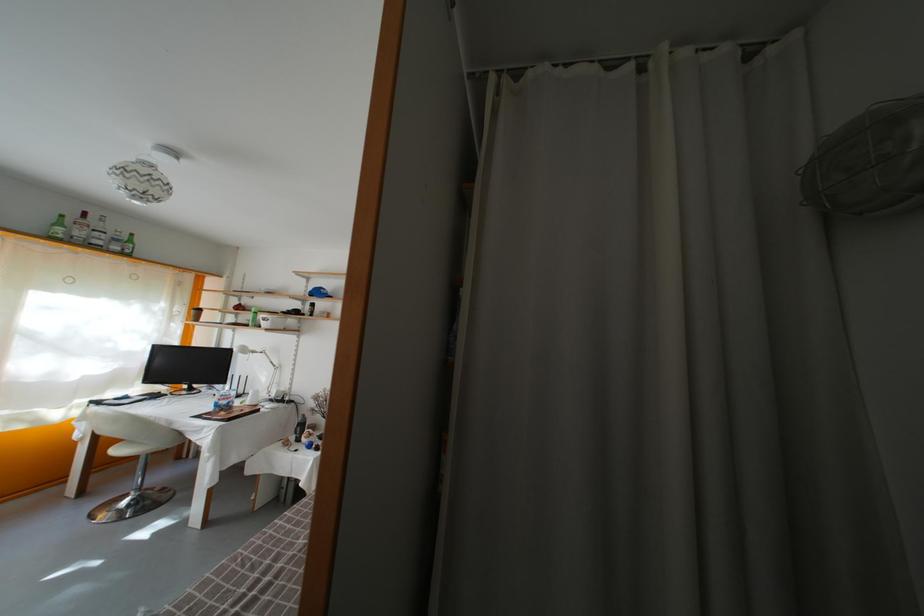
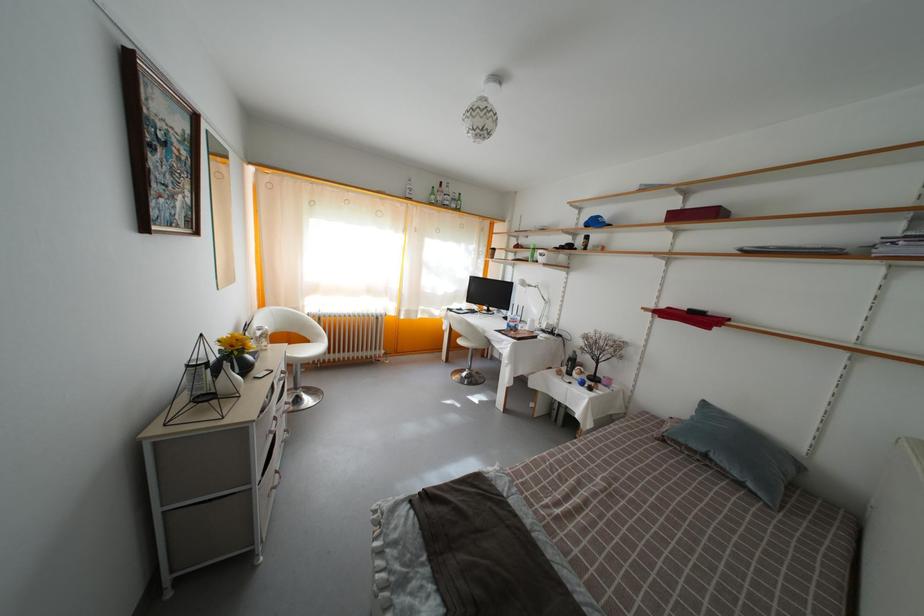
Question: The camera is either moving clockwise (left) or counter-clockwise (right) around the object. The first image is from the beginning of the video and the second image is from the end. Is the camera moving left or right when shooting the video?

Choices:
 (A) Left
 (B) Right

Answer: (B)